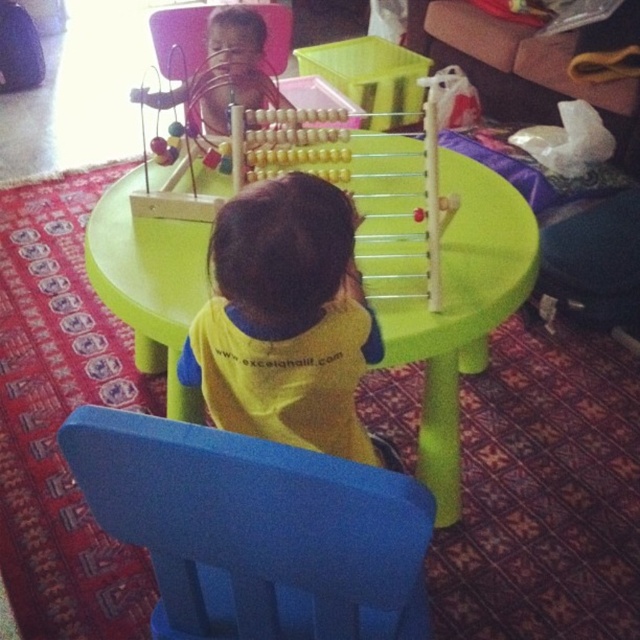
Can you confirm if blue plastic chair at lower center is thinner than wooden beads at center?

No.

Between point (147, 500) and point (257, 161), which one is positioned in front?

Point (147, 500) is more forward.

This screenshot has height=640, width=640. What are the coordinates of `blue plastic chair at lower center` in the screenshot? It's located at (256, 531).

Does green plastic table at center have a smaller size compared to yellow fabric toddler at center?

Incorrect, green plastic table at center is not smaller in size than yellow fabric toddler at center.

Identify the location of green plastic table at center. This screenshot has width=640, height=640. coord(461,310).

I want to click on green plastic table at center, so click(461, 310).

Identify the location of green plastic table at center. This screenshot has height=640, width=640. (461, 310).

Who is positioned more to the left, green plastic table at center or wooden beads at center?

A: Positioned to the left is wooden beads at center.

What do you see at coordinates (461, 310) in the screenshot? The image size is (640, 640). I see `green plastic table at center` at bounding box center [461, 310].

Find the location of a particular element. green plastic table at center is located at coordinates (461, 310).